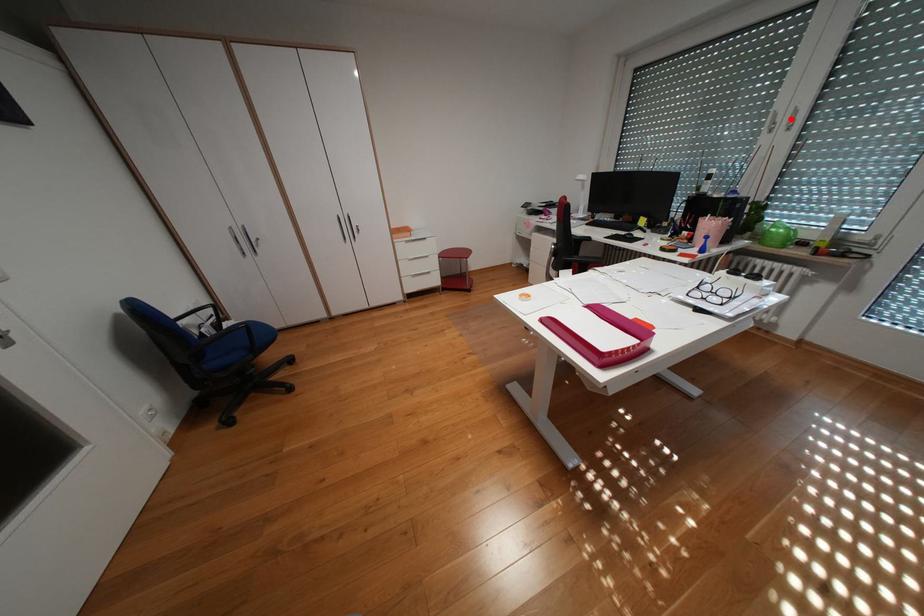
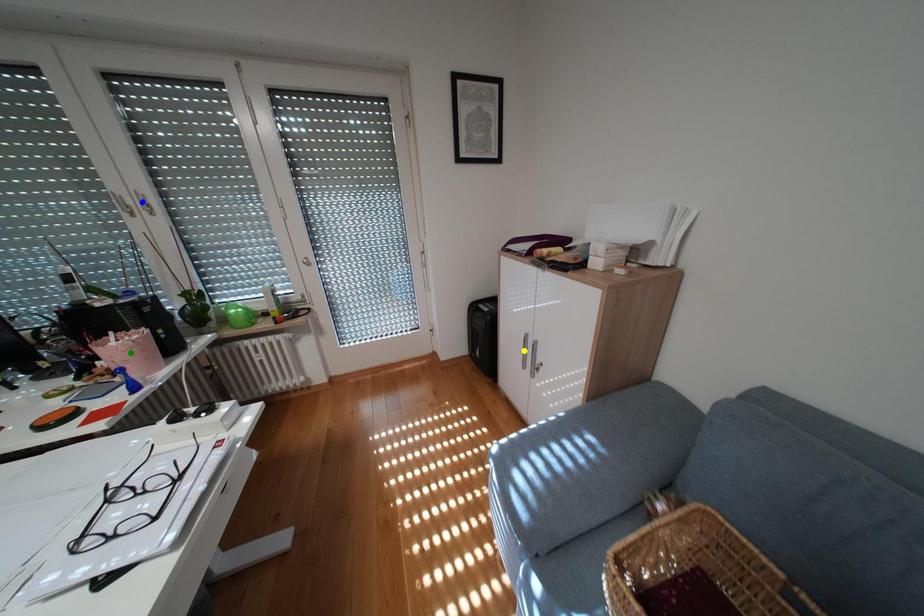
Question: I am providing you with two images of the same scene from different viewpoints. A red point is marked on the first image. You are given multiple points on the second image. Which spot in image 2 lines up with the point in image 1?

Choices:
 (A) blue point
 (B) yellow point
 (C) green point

Answer: (A)